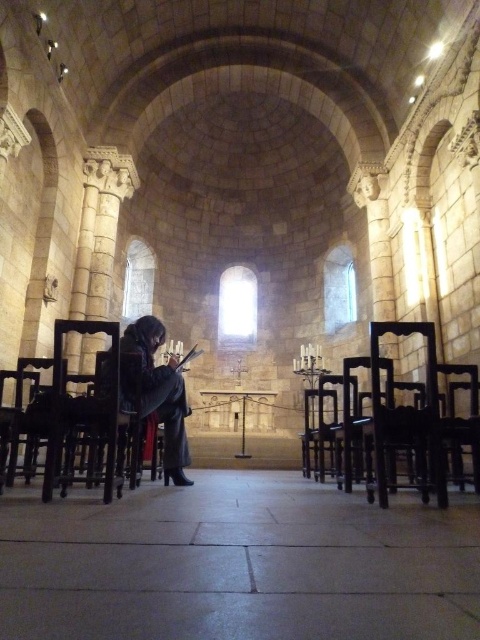
Question: Observing the image, what is the correct spatial positioning of wooden chair at left in reference to dark gray wool coat at center?

Choices:
 (A) left
 (B) right

Answer: (A)

Question: Can you confirm if smooth stone floor at center is smaller than wooden chair at left?

Choices:
 (A) yes
 (B) no

Answer: (A)

Question: Which point is closer to the camera?

Choices:
 (A) smooth stone floor at center
 (B) wooden chair at center
 (C) black wood chair at center

Answer: (A)

Question: Estimate the real-world distances between objects in this image. Which object is farther from the dark wood chair at right?

Choices:
 (A) dark gray wool coat at center
 (B) black wood chair at center
 (C) wooden chair at left

Answer: (C)

Question: Does wooden chair at center appear on the left side of black wood chair at center?

Choices:
 (A) yes
 (B) no

Answer: (A)

Question: Which is nearer to the wooden chair at center?

Choices:
 (A) dark wood chair at right
 (B) wooden chair at left

Answer: (A)